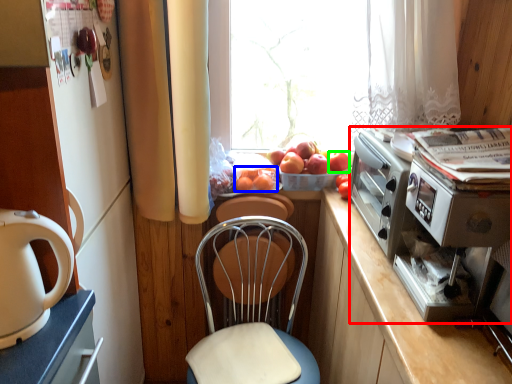
Question: Based on their relative distances, which object is nearer to appliance (highlighted by a red box)? Choose from fruit (highlighted by a blue box) and apple (highlighted by a green box).

Choices:
 (A) fruit
 (B) apple

Answer: (B)